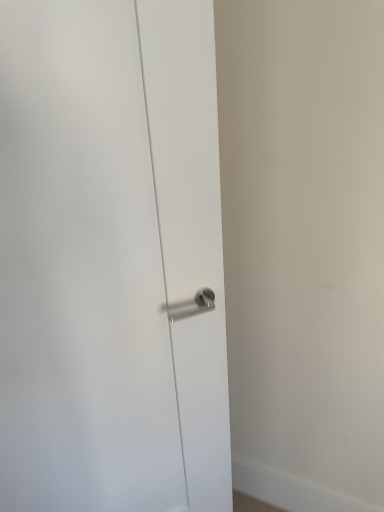
What is the approximate height of white matte door at center?

The height of white matte door at center is 5.04 feet.

Identify the location of white matte door at center. This screenshot has width=384, height=512. (111, 258).

This screenshot has height=512, width=384. Describe the element at coordinates (111, 258) in the screenshot. I see `white matte door at center` at that location.

Measure the distance between white matte door at center and camera.

The distance of white matte door at center from camera is 26.16 inches.

This screenshot has height=512, width=384. I want to click on white matte door at center, so click(111, 258).